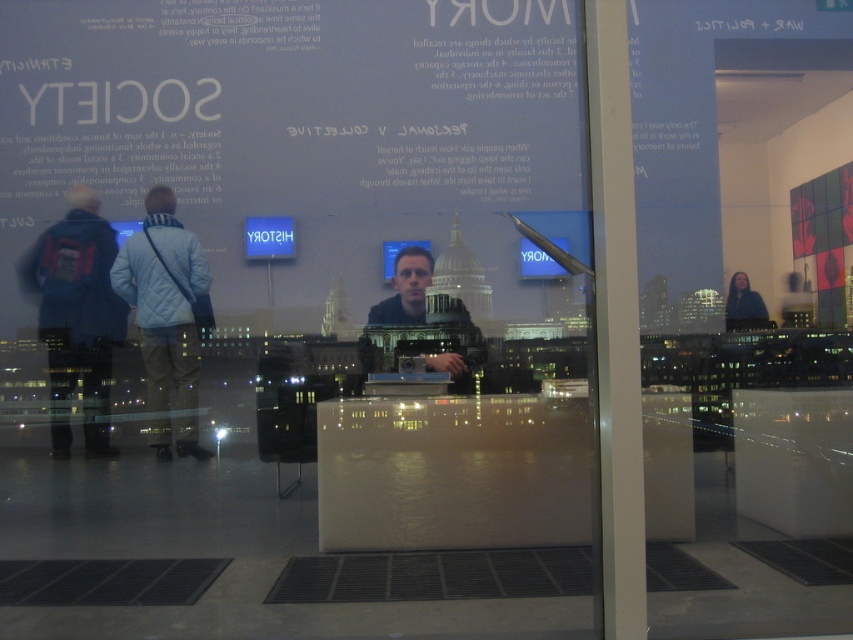
Question: Estimate the real-world distances between objects in this image. Which object is farther from the dark blue jacket at right?

Choices:
 (A) transparent glass door at right
 (B) denim jacket at left

Answer: (B)

Question: Which is nearer to the light blue quilted jacket at left?

Choices:
 (A) transparent glass door at right
 (B) dark blue jacket at right

Answer: (A)

Question: Which point is farther from the camera taking this photo?

Choices:
 (A) (732, 289)
 (B) (100, 451)
 (C) (817, 51)

Answer: (A)

Question: From the image, what is the correct spatial relationship of light blue quilted jacket at left in relation to dark blue jacket at right?

Choices:
 (A) right
 (B) left

Answer: (B)

Question: Is denim jacket at left bigger than dark blue jacket at right?

Choices:
 (A) yes
 (B) no

Answer: (A)

Question: Can you confirm if denim jacket at left is smaller than dark blue jacket at right?

Choices:
 (A) no
 (B) yes

Answer: (A)